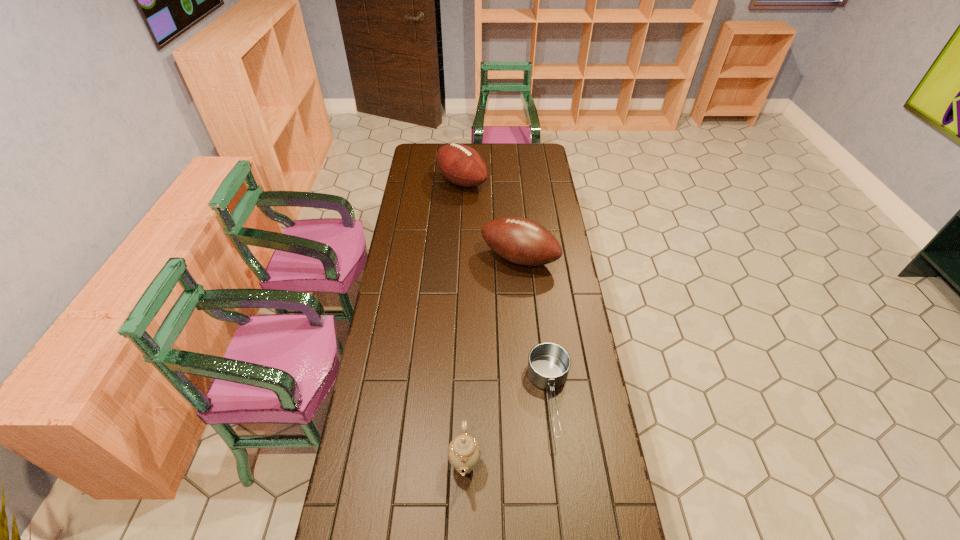
Locate an element on the screen. This screenshot has height=540, width=960. the farthest object is located at coordinates (462, 165).

Where is `the nearer football (American)`? Image resolution: width=960 pixels, height=540 pixels. the nearer football (American) is located at coordinates (521, 241).

Identify the location of the third tallest object. The image size is (960, 540). (464, 452).

Where is `saucepan`? The height and width of the screenshot is (540, 960). saucepan is located at coordinates (548, 363).

Find the location of a particular element. The image size is (960, 540). vacant area situated on the front of the farther football (American) is located at coordinates (459, 252).

What are the coordinates of `blank space located 0.350m on the left of the second farthest object` in the screenshot? It's located at (399, 258).

Identify the location of free space located 0.290m on the spout of the third tallest object. (580, 464).

Identify the location of vacant area situated 0.140m with the handle extending from one side of the saucepan. This screenshot has height=540, width=960. (562, 496).

Identify the location of object located at the left edge. This screenshot has width=960, height=540. (462, 165).

Locate an element on the screen. The image size is (960, 540). football (American) that is at the right edge is located at coordinates pyautogui.click(x=521, y=241).